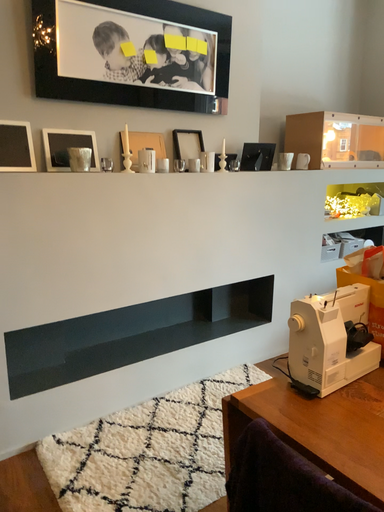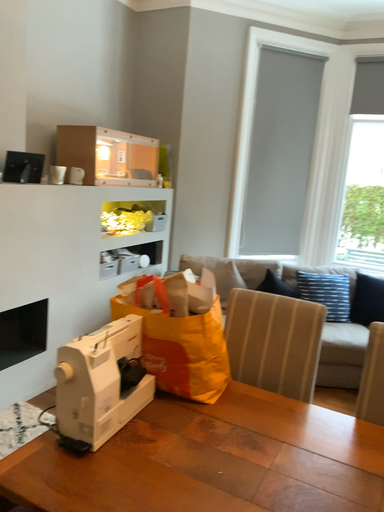
Question: How did the camera likely rotate when shooting the video?

Choices:
 (A) rotated left
 (B) rotated right

Answer: (B)